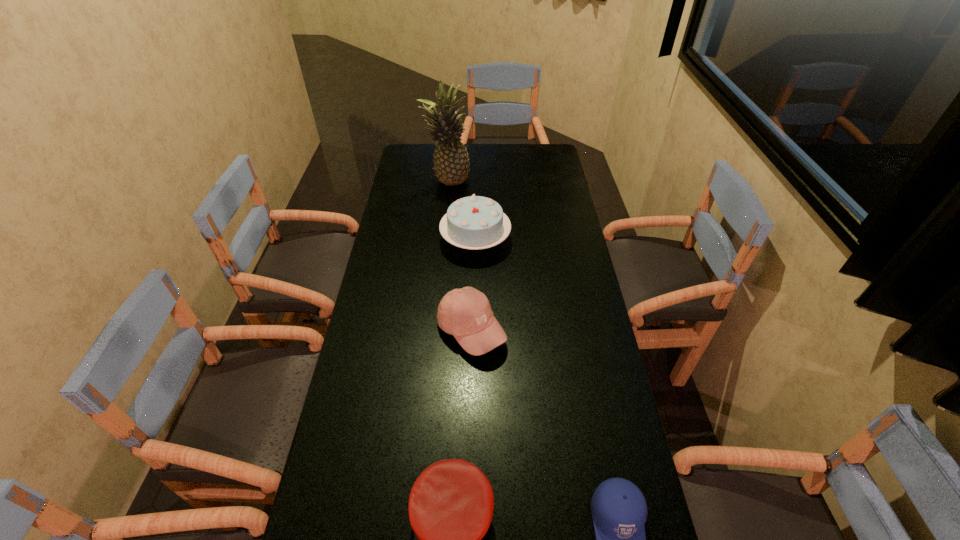
Where is `object that is at the left edge`? The width and height of the screenshot is (960, 540). object that is at the left edge is located at coordinates (451, 161).

Locate an element on the screen. The image size is (960, 540). object situated at the far left corner is located at coordinates (451, 161).

Where is `vacant space at the far edge of the desktop`? vacant space at the far edge of the desktop is located at coordinates (484, 170).

In the image, there is a desktop. What are the coordinates of `vacant space at the left edge` in the screenshot? It's located at (348, 389).

Image resolution: width=960 pixels, height=540 pixels. In the image, there is a desktop. Identify the location of vacant space at the right edge. (572, 353).

In the image, there is a desktop. Identify the location of vacant space at the far left corner. This screenshot has width=960, height=540. (424, 155).

At what (x,y) coordinates should I click in order to perform the action: click on vacant area at the far right corner. Please return your answer as a coordinate pair (x, y). This screenshot has width=960, height=540. Looking at the image, I should click on (552, 161).

At what (x,y) coordinates should I click in order to perform the action: click on free area in between the baseball cap and the tallest object. Please return your answer as a coordinate pair (x, y). Looking at the image, I should click on (459, 256).

Identify the location of vacant area that lies between the third shortest object and the tallest object. [x=459, y=256].

At what (x,y) coordinates should I click in order to perform the action: click on object that ranks as the fourth closest to the baseball cap. Please return your answer as a coordinate pair (x, y). Image resolution: width=960 pixels, height=540 pixels. Looking at the image, I should click on (451, 161).